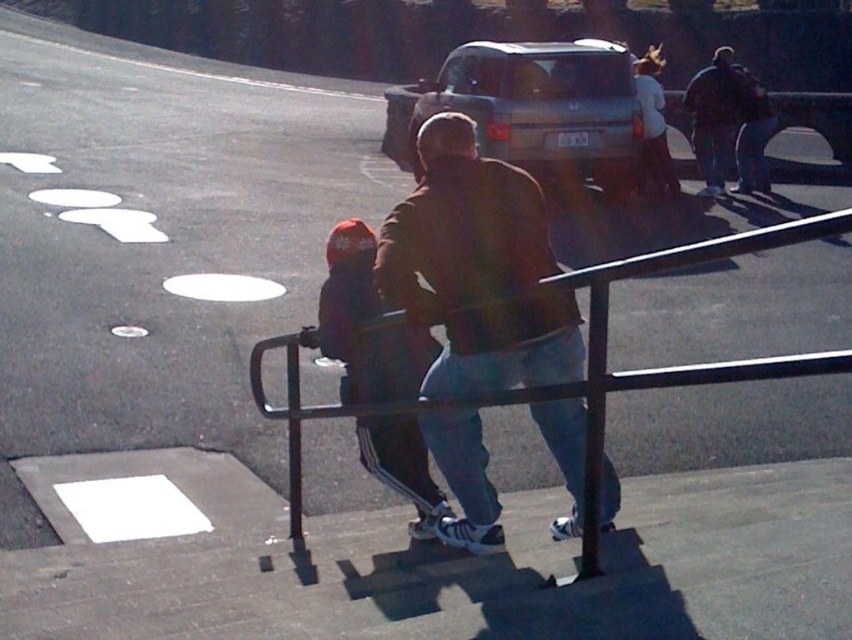
You are standing at the bottom of the stairs in the image. You want to reach the top of the stairs. Which direction should you move to first approach the black metal railing at center located at point (586,358)?

To reach the top of the stairs, you should first move towards the black metal railing at center located at point (586,358) since it is positioned along the side of the stairs and serves as a guide for ascending.

You are a painter who needs to paint the black metal railing at center and the dark blue fabric jacket at center. Which object requires more paint due to its thickness?

The dark blue fabric jacket at center requires more paint because it is thicker than the black metal railing at center.

You are standing on the stairs and want to hold onto the railing for support. Where should you reach to grab the black metal railing at center?

The black metal railing at center is located at point (586, 358), so you should reach there to grab it.